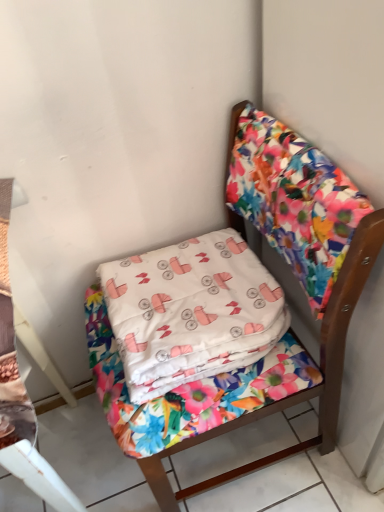
Image resolution: width=384 pixels, height=512 pixels. I want to click on blank space situated above white fabric pillow at center (from a real-world perspective), so click(x=180, y=285).